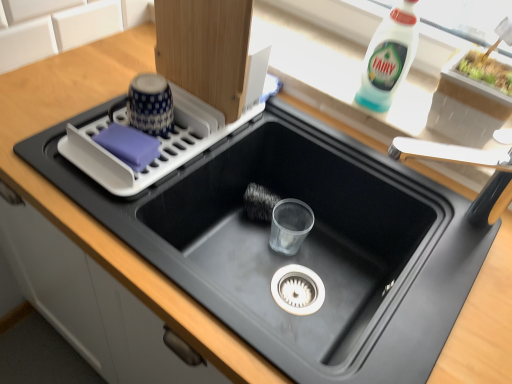
Question: Does white plastic bottle at upper right contain black matte sink at center?

Choices:
 (A) yes
 (B) no

Answer: (B)

Question: Is white plastic bottle at upper right to the left of black matte sink at center from the viewer's perspective?

Choices:
 (A) yes
 (B) no

Answer: (B)

Question: From the image's perspective, would you say white plastic bottle at upper right is shown under black matte sink at center?

Choices:
 (A) yes
 (B) no

Answer: (B)

Question: Is the position of white plastic bottle at upper right more distant than that of black matte sink at center?

Choices:
 (A) no
 (B) yes

Answer: (B)

Question: Would you say white plastic bottle at upper right is a long distance from black matte sink at center?

Choices:
 (A) yes
 (B) no

Answer: (B)

Question: Considering the positions of white plastic dish rack at upper left and black matte sink at center in the image, is white plastic dish rack at upper left taller or shorter than black matte sink at center?

Choices:
 (A) tall
 (B) short

Answer: (B)

Question: Considering the positions of white plastic dish rack at upper left and black matte sink at center in the image, is white plastic dish rack at upper left wider or thinner than black matte sink at center?

Choices:
 (A) thin
 (B) wide

Answer: (A)

Question: Is white plastic dish rack at upper left to the left or to the right of black matte sink at center in the image?

Choices:
 (A) left
 (B) right

Answer: (A)

Question: From the image's perspective, relative to black matte sink at center, is white plastic dish rack at upper left above or below?

Choices:
 (A) below
 (B) above

Answer: (B)

Question: Do you think white plastic bottle at upper right is within white plastic dish rack at upper left, or outside of it?

Choices:
 (A) inside
 (B) outside

Answer: (B)

Question: Based on their sizes in the image, would you say white plastic bottle at upper right is bigger or smaller than white plastic dish rack at upper left?

Choices:
 (A) big
 (B) small

Answer: (B)

Question: From their relative heights in the image, would you say white plastic bottle at upper right is taller or shorter than white plastic dish rack at upper left?

Choices:
 (A) tall
 (B) short

Answer: (A)

Question: Does point (394, 34) appear closer or farther from the camera than point (204, 132)?

Choices:
 (A) closer
 (B) farther

Answer: (A)

Question: Is white plastic faucet at upper right bigger or smaller than black matte sink at center?

Choices:
 (A) small
 (B) big

Answer: (A)

Question: From a real-world perspective, is white plastic faucet at upper right positioned above or below black matte sink at center?

Choices:
 (A) below
 (B) above

Answer: (B)